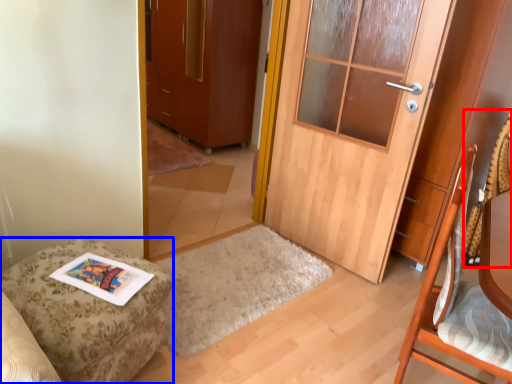
Question: Which point is further to the camera, swivel chair (highlighted by a red box) or furniture (highlighted by a blue box)?

Choices:
 (A) swivel chair
 (B) furniture

Answer: (A)